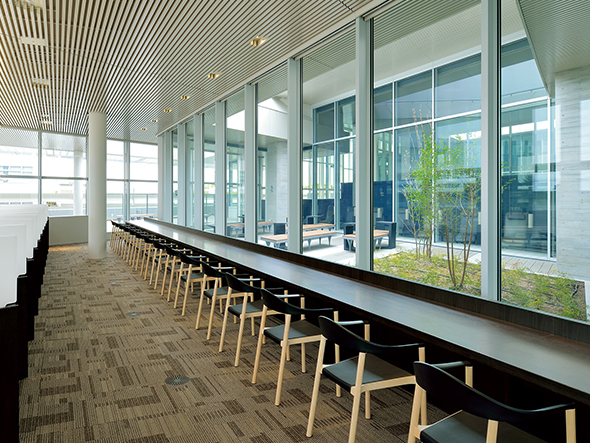
Find the location of `round lights ceiling`. round lights ceiling is located at coordinates (140, 129), (152, 118), (167, 108), (186, 94), (213, 75), (255, 40).